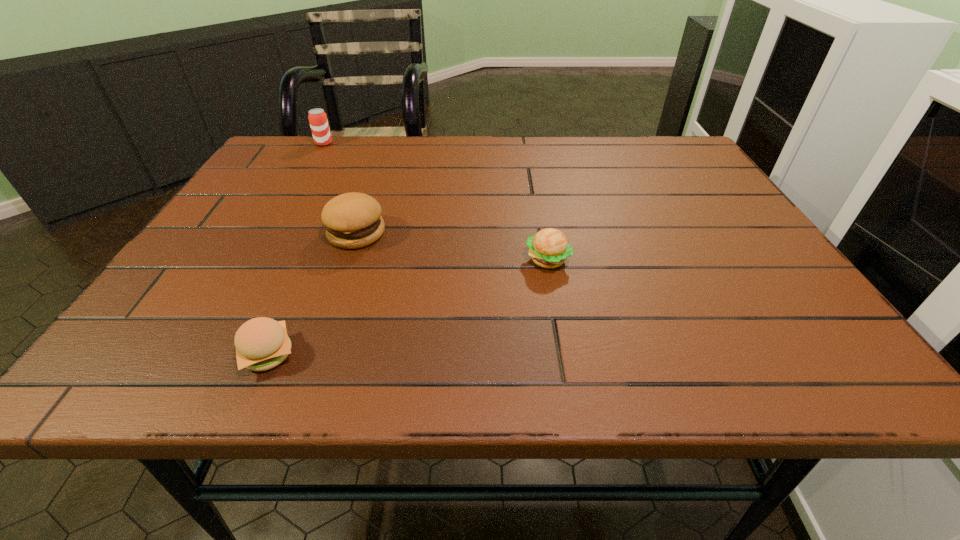
In order to click on free space between the nearest hamburger and the beer can in this screenshot , I will do `click(296, 249)`.

Where is `free space between the tallest hamburger and the nearest object`? free space between the tallest hamburger and the nearest object is located at coordinates (312, 294).

You are a GUI agent. You are given a task and a screenshot of the screen. Output one action in this format:
    pyautogui.click(x=<x>, y=<y>)
    Task: Click on the free space between the nearest object and the farthest object
    This screenshot has width=960, height=540.
    Given the screenshot: What is the action you would take?
    pyautogui.click(x=296, y=249)

You are a GUI agent. You are given a task and a screenshot of the screen. Output one action in this format:
    pyautogui.click(x=<x>, y=<y>)
    Task: Click on the vacant space that's between the rightmost object and the tallest hamburger
    
    Given the screenshot: What is the action you would take?
    pyautogui.click(x=452, y=246)

Locate an element on the screen. free area in between the nearest object and the rightmost hamburger is located at coordinates (408, 307).

Identify the location of free space between the nearest hamburger and the rightmost hamburger. The image size is (960, 540). (408, 307).

Identify the location of free point between the nearest object and the tallest hamburger. (312, 294).

Identify the location of vacant area between the leftmost object and the nearest object. (296, 249).

The width and height of the screenshot is (960, 540). I want to click on vacant region between the farthest object and the rightmost object, so click(x=436, y=201).

Locate which object ranks second in proximity to the rightmost object. Please provide its 2D coordinates. Your answer should be formatted as a tuple, i.e. [(x, y)], where the tuple contains the x and y coordinates of a point satisfying the conditions above.

[(262, 343)]